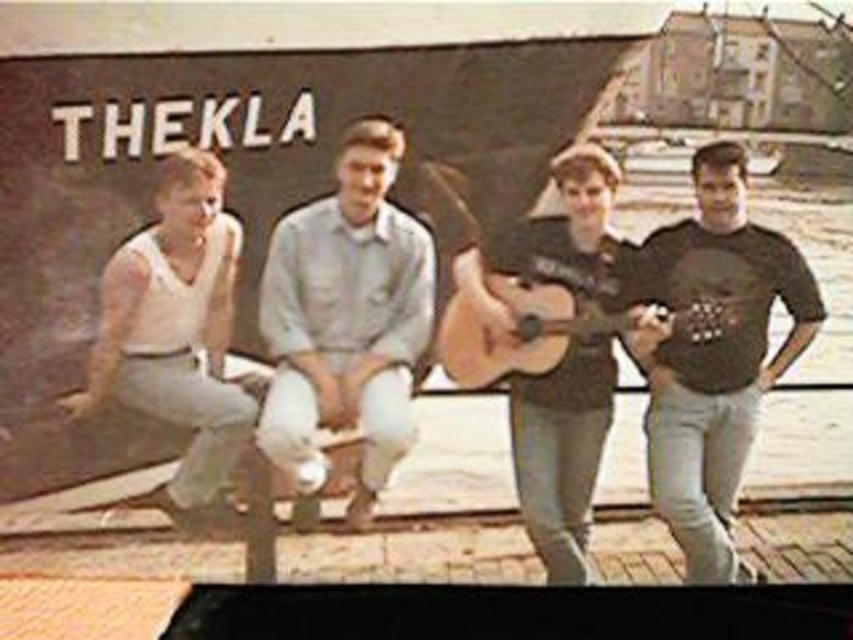
Does light gray cotton shirt at center appear on the right side of white matte tank top at left?

Yes, light gray cotton shirt at center is to the right of white matte tank top at left.

Image resolution: width=853 pixels, height=640 pixels. Describe the element at coordinates (346, 317) in the screenshot. I see `light gray cotton shirt at center` at that location.

This screenshot has height=640, width=853. I want to click on light gray cotton shirt at center, so click(346, 317).

Is point (715, 460) more distant than point (543, 536)?

No, (715, 460) is in front of (543, 536).

Image resolution: width=853 pixels, height=640 pixels. What do you see at coordinates (715, 355) in the screenshot? I see `dark brown t-shirt at right` at bounding box center [715, 355].

Locate an element on the screen. Image resolution: width=853 pixels, height=640 pixels. dark brown t-shirt at right is located at coordinates (715, 355).

Is white matte tank top at left thinner than light brown wooden guitar at center?

Yes.

Does white matte tank top at left have a smaller size compared to light brown wooden guitar at center?

No.

Is point (192, 326) positioned after point (598, 314)?

No, (192, 326) is in front of (598, 314).

I want to click on white matte tank top at left, so click(178, 339).